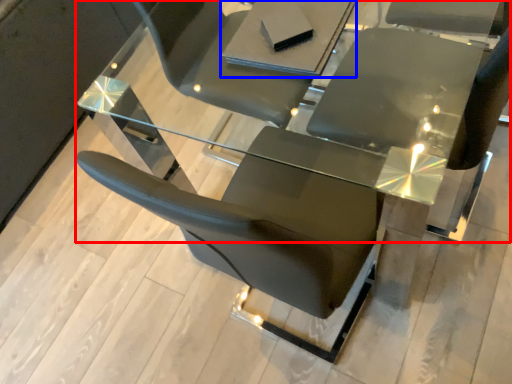
Question: Which of the following is the farthest to the observer, table (highlighted by a red box) or table (highlighted by a blue box)?

Choices:
 (A) table
 (B) table

Answer: (B)